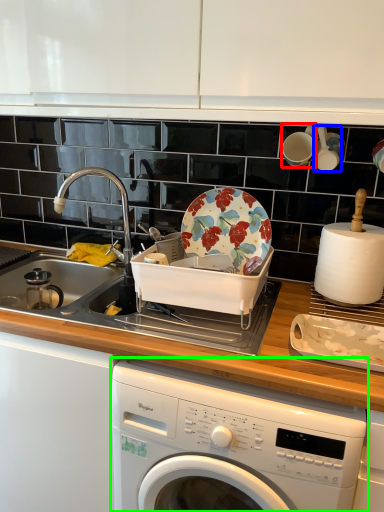
Question: Considering the real-world distances, which object is closest to tableware (highlighted by a red box)? tableware (highlighted by a blue box) or washing machine (highlighted by a green box).

Choices:
 (A) tableware
 (B) washing machine

Answer: (A)